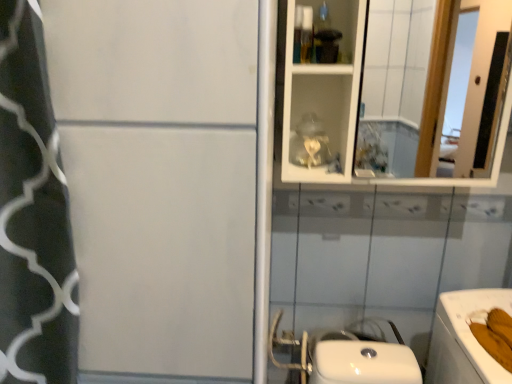
Question: From a real-world perspective, is white glossy bath at lower right on white glossy mirror at upper right?

Choices:
 (A) yes
 (B) no

Answer: (B)

Question: Can you confirm if white glossy bath at lower right is thinner than white glossy mirror at upper right?

Choices:
 (A) no
 (B) yes

Answer: (A)

Question: Considering the relative sizes of white glossy bath at lower right and white glossy mirror at upper right in the image provided, is white glossy bath at lower right smaller than white glossy mirror at upper right?

Choices:
 (A) yes
 (B) no

Answer: (B)

Question: Does white glossy bath at lower right appear on the right side of white glossy mirror at upper right?

Choices:
 (A) no
 (B) yes

Answer: (B)

Question: Can you confirm if white glossy bath at lower right is shorter than white glossy mirror at upper right?

Choices:
 (A) no
 (B) yes

Answer: (B)

Question: From a real-world perspective, is white glossy bath at lower right positioned under white glossy mirror at upper right based on gravity?

Choices:
 (A) yes
 (B) no

Answer: (A)

Question: Can you confirm if white glossy mirror at upper right is smaller than white glossy bath at lower right?

Choices:
 (A) no
 (B) yes

Answer: (B)

Question: Does white glossy mirror at upper right contain white glossy bath at lower right?

Choices:
 (A) no
 (B) yes

Answer: (A)

Question: From a real-world perspective, is white glossy mirror at upper right positioned under white glossy bath at lower right based on gravity?

Choices:
 (A) yes
 (B) no

Answer: (B)

Question: From a real-world perspective, is white glossy mirror at upper right located higher than white glossy bath at lower right?

Choices:
 (A) no
 (B) yes

Answer: (B)

Question: Considering the relative sizes of white glossy mirror at upper right and white glossy bath at lower right in the image provided, is white glossy mirror at upper right shorter than white glossy bath at lower right?

Choices:
 (A) no
 (B) yes

Answer: (A)

Question: From the image's perspective, is white glossy mirror at upper right above white glossy bath at lower right?

Choices:
 (A) yes
 (B) no

Answer: (A)

Question: Considering their positions, is white glossy bath at lower right located in front of or behind white glossy mirror at upper right?

Choices:
 (A) behind
 (B) front

Answer: (B)